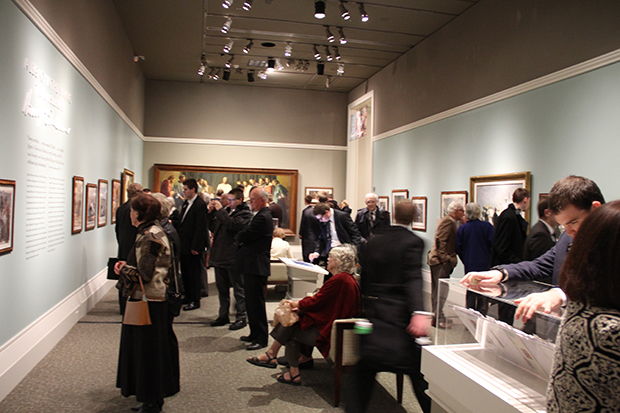
This screenshot has height=413, width=620. Find the location of `brown carpet on the floor`. brown carpet on the floor is located at coordinates (206, 342), (218, 388).